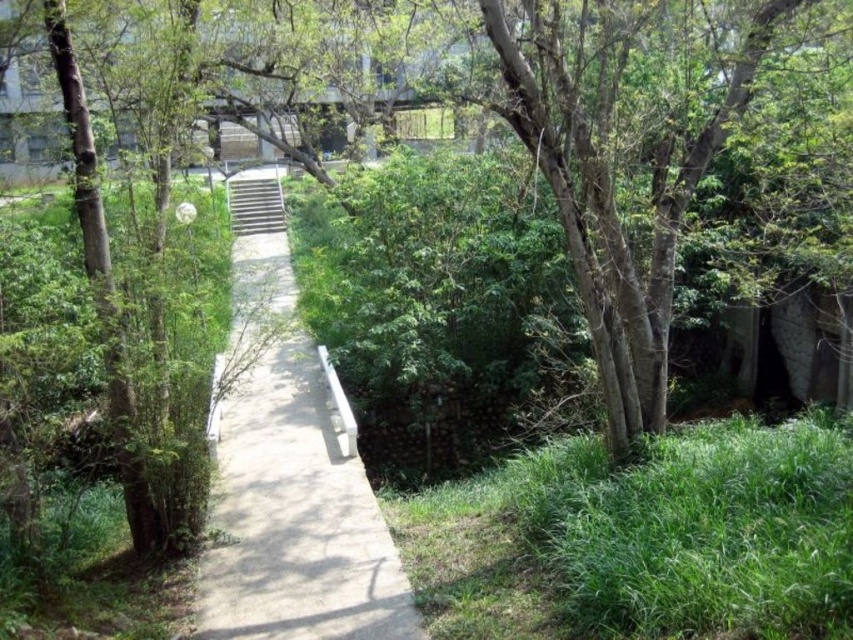
You are a maintenance worker needing to inspect the metallic gray stairs at center. According to the scene, where is the concrete at center located in relation to the stairs?

The concrete at center is positioned under the metallic gray stairs at center, so the stairs are resting on top of the concrete.